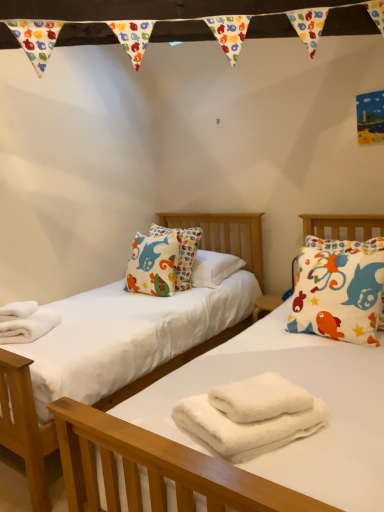
Describe the element at coordinates (259, 398) in the screenshot. The image size is (384, 512). I see `white fluffy bath towel at center, marked as the second bath towel in a bottom-to-top arrangement` at that location.

You are a GUI agent. You are given a task and a screenshot of the screen. Output one action in this format:
    pyautogui.click(x=<x>, y=<y>)
    Task: Click on the white cotton pillow with colorful fish at right
    
    Given the screenshot: What is the action you would take?
    pyautogui.click(x=338, y=290)

The width and height of the screenshot is (384, 512). Find the location of `white fluffy towels at center, the second bath towel when ordered from top to bottom`. white fluffy towels at center, the second bath towel when ordered from top to bottom is located at coordinates (251, 415).

The width and height of the screenshot is (384, 512). Describe the element at coordinates (25, 322) in the screenshot. I see `white fluffy towels at lower left` at that location.

Where is `white fluffy bath towel at center, marked as the second bath towel in a bottom-to-top arrangement`? This screenshot has height=512, width=384. white fluffy bath towel at center, marked as the second bath towel in a bottom-to-top arrangement is located at coordinates (259, 398).

Does white fluffy towels at center, the second bath towel when ordered from top to bottom, have a lesser width compared to white fluffy towels at lower left?

Yes.

Is white fluffy towels at center, the second bath towel when ordered from top to bottom, inside the boundaries of white fluffy towels at lower left, or outside?

white fluffy towels at center, the second bath towel when ordered from top to bottom, lies outside white fluffy towels at lower left.

Between white fluffy towels at center, the second bath towel when ordered from top to bottom, and white fluffy towels at lower left, which one has smaller size?

white fluffy towels at center, the second bath towel when ordered from top to bottom, is smaller.

Identify the location of material lying on the left of white fluffy towels at center, the second bath towel when ordered from top to bottom. This screenshot has height=512, width=384. (25, 322).

Would you say white fluffy bath towel at center, marked as the second bath towel in a bottom-to-top arrangement, contains white cotton pillow with colorful fish at right?

No, white cotton pillow with colorful fish at right is not inside white fluffy bath towel at center, marked as the second bath towel in a bottom-to-top arrangement.

Based on the photo, does white fluffy bath towel at center, marked as the second bath towel in a bottom-to-top arrangement, have a larger size compared to white cotton pillow with colorful fish at right?

Incorrect, white fluffy bath towel at center, marked as the second bath towel in a bottom-to-top arrangement, is not larger than white cotton pillow with colorful fish at right.

In terms of height, does white fluffy bath towel at center, the first bath towel when ordered from top to bottom, look taller or shorter compared to white cotton pillow with colorful fish at right?

Clearly, white fluffy bath towel at center, the first bath towel when ordered from top to bottom, is shorter compared to white cotton pillow with colorful fish at right.

Is white fluffy bath towel at center, the first bath towel when ordered from top to bottom, not near white cotton pillow with colorful fish at right?

white fluffy bath towel at center, the first bath towel when ordered from top to bottom, is near white cotton pillow with colorful fish at right, not far away.

Would you say white fluffy towels at lower left is inside or outside white fluffy towels at center, the second bath towel when ordered from top to bottom?

white fluffy towels at lower left is not inside white fluffy towels at center, the second bath towel when ordered from top to bottom, it's outside.

Are white fluffy towels at lower left and white fluffy towels at center, the second bath towel when ordered from top to bottom, located far from each other?

Yes, white fluffy towels at lower left and white fluffy towels at center, the second bath towel when ordered from top to bottom, are quite far apart.

Which is more to the right, white fluffy towels at lower left or white fluffy towels at center, the second bath towel when ordered from top to bottom?

From the viewer's perspective, white fluffy towels at center, the second bath towel when ordered from top to bottom, appears more on the right side.

Is point (40, 309) more distant than point (254, 421)?

Yes, it is.

Can you confirm if white fluffy towels at lower left is positioned to the right of white cotton pillow with colorful fish at right?

No.

From the image's perspective, is white fluffy towels at lower left on white cotton pillow with colorful fish at right?

No.

What's the angular difference between white fluffy towels at lower left and white cotton pillow with colorful fish at right's facing directions?

40.8 degrees separate the facing orientations of white fluffy towels at lower left and white cotton pillow with colorful fish at right.

Is white fluffy towels at lower left positioned before white cotton pillow with colorful fish at right?

No, it is not.

From the image's perspective, between white fluffy towels at center, which is the 1th bath towel in bottom-to-top order, and white fluffy bath towel at center, the first bath towel when ordered from top to bottom, who is located below?

From the image's view, white fluffy towels at center, which is the 1th bath towel in bottom-to-top order, is below.

Locate an element on the screen. The height and width of the screenshot is (512, 384). bath towel above the white fluffy towels at center, which is the 1th bath towel in bottom-to-top order (from a real-world perspective) is located at coordinates (259, 398).

Which point is more distant from viewer, (193, 399) or (248, 400)?

Point (193, 399)

Is white fluffy bath towel at center, marked as the second bath towel in a bottom-to-top arrangement, wider or thinner than white fluffy towels at lower left?

Clearly, white fluffy bath towel at center, marked as the second bath towel in a bottom-to-top arrangement, has less width compared to white fluffy towels at lower left.

Is white fluffy bath towel at center, the first bath towel when ordered from top to bottom, facing away from white fluffy towels at lower left?

No, white fluffy bath towel at center, the first bath towel when ordered from top to bottom,'s orientation is not away from white fluffy towels at lower left.

Is white fluffy bath towel at center, marked as the second bath towel in a bottom-to-top arrangement, shorter than white fluffy towels at lower left?

Indeed, white fluffy bath towel at center, marked as the second bath towel in a bottom-to-top arrangement, has a lesser height compared to white fluffy towels at lower left.

Would you consider white fluffy bath towel at center, marked as the second bath towel in a bottom-to-top arrangement, to be distant from white fluffy towels at lower left?

Indeed, white fluffy bath towel at center, marked as the second bath towel in a bottom-to-top arrangement, is not near white fluffy towels at lower left.

In the scene shown: Is the depth of white fluffy towels at lower left greater than that of white fluffy bath towel at center, the first bath towel when ordered from top to bottom?

Yes, white fluffy towels at lower left is further from the camera.

The image size is (384, 512). What are the coordinates of `the 1st bath towel below the white fluffy towels at lower left (from the image's perspective)` in the screenshot? It's located at pyautogui.click(x=259, y=398).

How much distance is there between white fluffy towels at lower left and white fluffy bath towel at center, the first bath towel when ordered from top to bottom?

white fluffy towels at lower left and white fluffy bath towel at center, the first bath towel when ordered from top to bottom, are 4.19 feet apart.

From the image's perspective, is white fluffy towels at lower left located above white fluffy bath towel at center, the first bath towel when ordered from top to bottom?

Indeed, from the image's perspective, white fluffy towels at lower left is shown above white fluffy bath towel at center, the first bath towel when ordered from top to bottom.

Find the location of a particular element. the 2nd bath towel in front when counting from the white fluffy towels at lower left is located at coordinates (251, 415).

At what (x,y) coordinates should I click in order to perform the action: click on bath towel that is the 1st one below the white cotton pillow with colorful fish at right (from a real-world perspective). Please return your answer as a coordinate pair (x, y). Looking at the image, I should click on (259, 398).

Based on their spatial positions, is white fluffy towels at lower left or white cotton pillow with colorful fish at right closer to white fluffy bath towel at center, the first bath towel when ordered from top to bottom?

The object closer to white fluffy bath towel at center, the first bath towel when ordered from top to bottom, is white cotton pillow with colorful fish at right.

From the picture: Looking at the image, which one is located further to white fluffy towels at center, the second bath towel when ordered from top to bottom, white fluffy bath towel at center, marked as the second bath towel in a bottom-to-top arrangement, or white fluffy towels at lower left?

The object further to white fluffy towels at center, the second bath towel when ordered from top to bottom, is white fluffy towels at lower left.

Looking at the image, which one is located closer to white cotton pillow with colorful fish at right, white fluffy bath towel at center, marked as the second bath towel in a bottom-to-top arrangement, or white fluffy towels at center, which is the 1th bath towel in bottom-to-top order?

The object closer to white cotton pillow with colorful fish at right is white fluffy bath towel at center, marked as the second bath towel in a bottom-to-top arrangement.

From the image, which object appears to be nearer to white fluffy towels at lower left, white fluffy bath towel at center, the first bath towel when ordered from top to bottom, or white cotton pillow with colorful fish at right?

white fluffy bath towel at center, the first bath towel when ordered from top to bottom, lies closer to white fluffy towels at lower left than the other object.

When comparing their distances from white fluffy towels at lower left, does white fluffy bath towel at center, marked as the second bath towel in a bottom-to-top arrangement, or white fluffy towels at center, which is the 1th bath towel in bottom-to-top order, seem further?

white fluffy bath towel at center, marked as the second bath towel in a bottom-to-top arrangement, lies further to white fluffy towels at lower left than the other object.

Considering their positions, is white fluffy bath towel at center, marked as the second bath towel in a bottom-to-top arrangement, positioned further to white fluffy towels at center, which is the 1th bath towel in bottom-to-top order, than white cotton pillow with colorful fish at right?

white cotton pillow with colorful fish at right is further to white fluffy towels at center, which is the 1th bath towel in bottom-to-top order.

From the image, which object appears to be nearer to white cotton pillow with colorful fish at right, white fluffy towels at lower left or white fluffy bath towel at center, the first bath towel when ordered from top to bottom?

white fluffy bath towel at center, the first bath towel when ordered from top to bottom, lies closer to white cotton pillow with colorful fish at right than the other object.

From the image, which object appears to be farther from white fluffy towels at center, which is the 1th bath towel in bottom-to-top order, white fluffy towels at lower left or white fluffy bath towel at center, marked as the second bath towel in a bottom-to-top arrangement?

Among the two, white fluffy towels at lower left is located further to white fluffy towels at center, which is the 1th bath towel in bottom-to-top order.

This screenshot has width=384, height=512. I want to click on bath towel positioned between white fluffy towels at center, the second bath towel when ordered from top to bottom, and white cotton pillow with colorful fish at right from near to far, so click(259, 398).

Where is `bath towel between white fluffy towels at lower left and white fluffy bath towel at center, the first bath towel when ordered from top to bottom, in the horizontal direction`? The image size is (384, 512). bath towel between white fluffy towels at lower left and white fluffy bath towel at center, the first bath towel when ordered from top to bottom, in the horizontal direction is located at coordinates (251, 415).